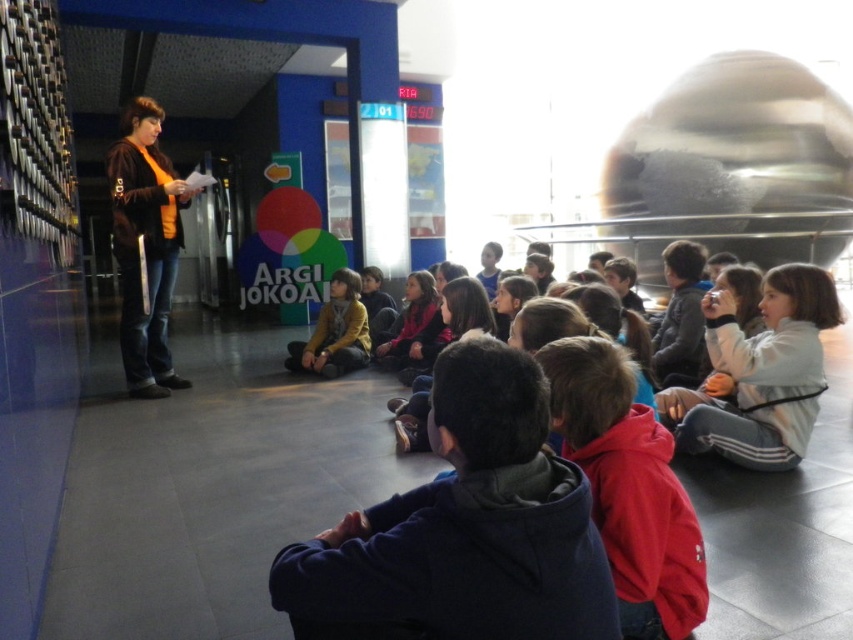
You are a photographer standing at the back of the room and want to take a photo of the children. You notice the red fleece jacket at lower right and the white fleece jacket at lower right. Which jacket will appear smaller in the photo?

The red fleece jacket at lower right appears smaller in the photo because it is not as tall as the white fleece jacket at lower right.

You are a photographer standing behind the group of children and want to take a photo of the red fleece jacket at lower right and the matte yellow sweater at center. Which one will be more visible in the photo?

The matte yellow sweater at center will be more visible in the photo because it has a greater height compared to the red fleece jacket at lower right, making it stand out more in the frame.

You are a photographer taking a picture of the children and the woman in the scene. You want to ensure both the red fleece jacket at lower right and the orange fleece jacket at left are visible in the frame. Based on their positions, which jacket is closer to the bottom edge of the photo?

The red fleece jacket at lower right is closer to the bottom edge of the photo because it is positioned below the orange fleece jacket at left.